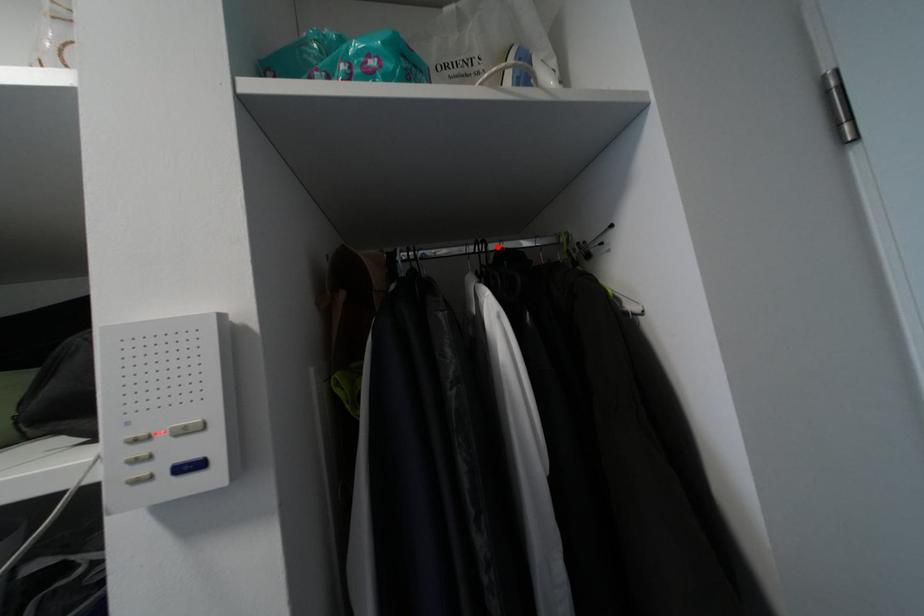
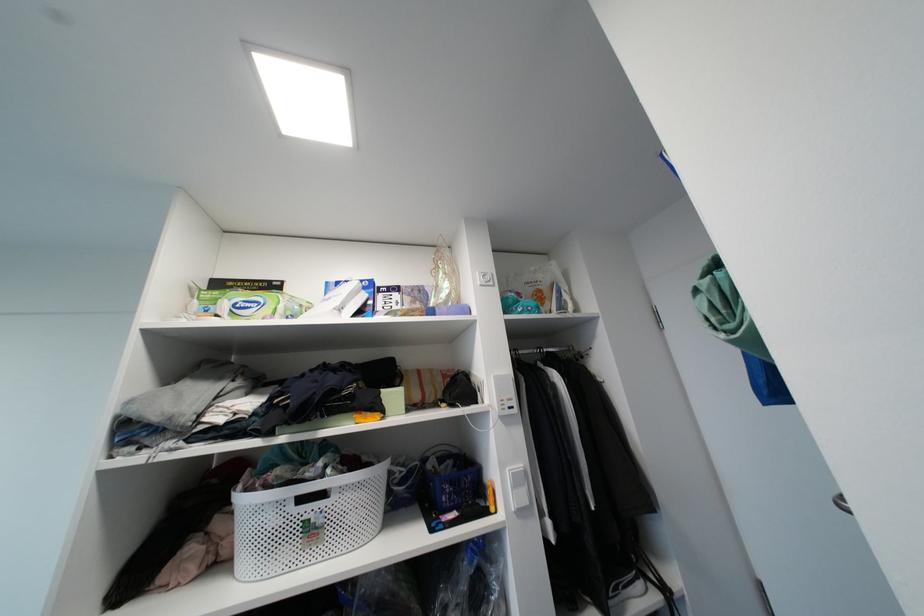
Locate, in the second image, the point that corresponds to the highlighted location in the first image.

(550, 351)